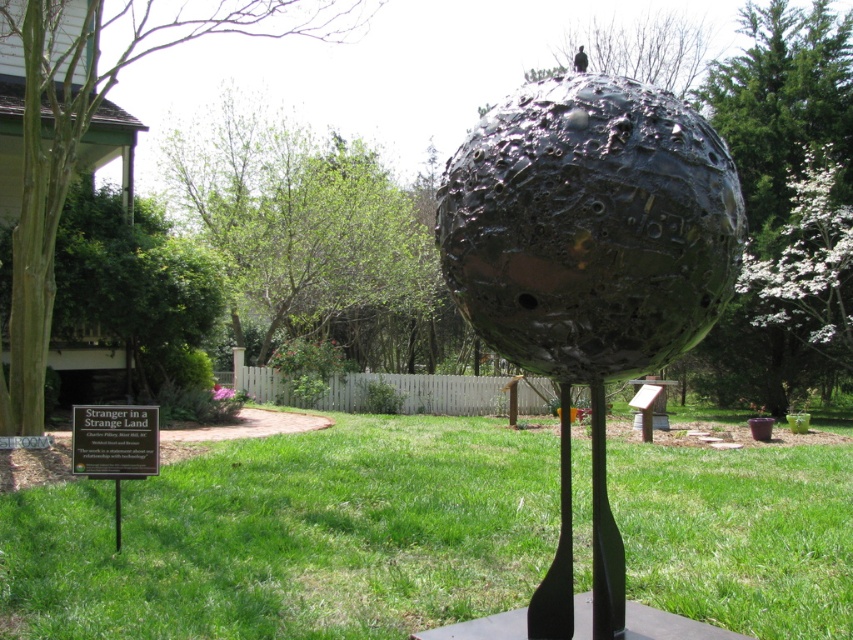
You are standing in the outdoor scene and want to walk from the green grass at center to the shiny metallic sphere at center. Which direction should you move to reach the sphere?

The green grass at center is to the left of the shiny metallic sphere at center, so you should move to the right to reach the sphere.

You are a gardener trying to mow the green grass at center. The shiny metallic sphere at center is in the way. Can you move the sphere to the side to access the grass?

The green grass at center has a lesser width compared to the shiny metallic sphere at center, meaning the sphere is wider. Moving it might be difficult due to its size, so it might block access to the grass.